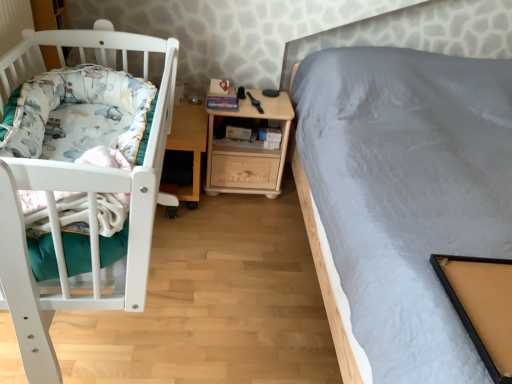
Locate an element on the screen. The height and width of the screenshot is (384, 512). vacant area that lies between wooden nightstand at center and wooden table at center is located at coordinates (232, 202).